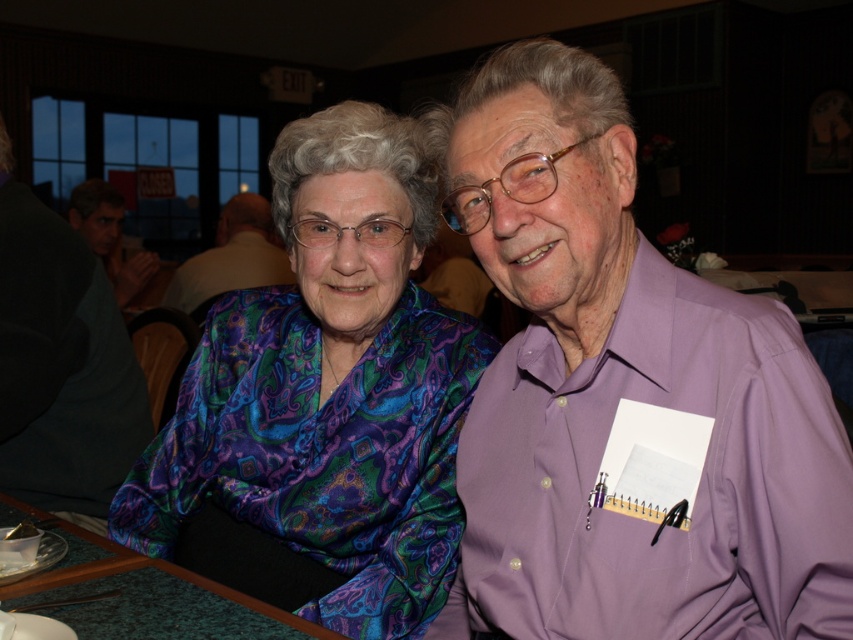
Who is positioned more to the right, dark gray shirt at left or green felt table at lower left?

green felt table at lower left is more to the right.

Does point (59, 273) lie behind point (165, 612)?

Yes, point (59, 273) is farther from viewer.

This screenshot has height=640, width=853. Identify the location of dark gray shirt at left. (61, 364).

Does purple smooth shirt at right appear on the right side of dark gray shirt at left?

Indeed, purple smooth shirt at right is positioned on the right side of dark gray shirt at left.

Is point (491, 268) positioned after point (7, 256)?

No.

Is point (537, 444) farther from viewer compared to point (93, 458)?

That is False.

Find the location of a particular element. purple smooth shirt at right is located at coordinates (624, 394).

Is point (228, 616) more distant than point (97, 211)?

No, it is in front of (97, 211).

The height and width of the screenshot is (640, 853). Describe the element at coordinates (149, 596) in the screenshot. I see `green felt table at lower left` at that location.

What are the coordinates of `green felt table at lower left` in the screenshot? It's located at (149, 596).